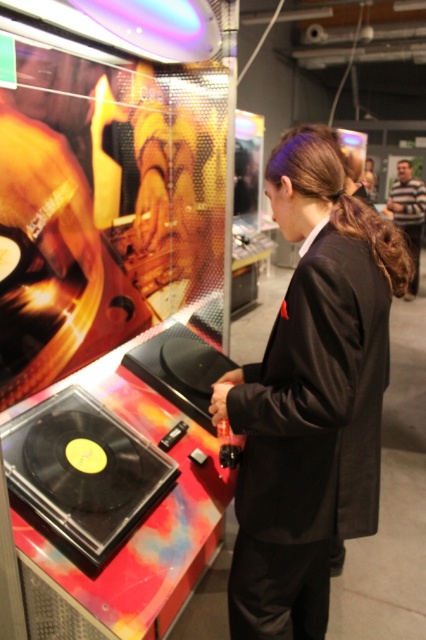
Consider the image. You are an event organizer planning to seat guests at a table. You have two items to place on the table next to each other. The black matte suit at center and the striped sweater at upper right. Which item should you place closer to the edge of the table to ensure both fit comfortably?

The black matte suit at center is thinner than the striped sweater at upper right, so placing the black matte suit at center closer to the edge would allow both items to fit comfortably on the table.

You are a photographer at the event and need to position a spotlight. The spotlight can only illuminate objects taller than the black matte suit at center. Can the striped sweater at upper right be illuminated by the spotlight?

The black matte suit at center is not as tall as striped sweater at upper right. Since the spotlight requires objects taller than the black matte suit at center, the striped sweater at upper right qualifies and can be illuminated by the spotlight.

You are an event planner organizing a fashion show and need to place a model wearing the black matte suit at center and another wearing the striped sweater at upper right. According to the spatial arrangement in the image, which model should be positioned to the left side of the runway?

The black matte suit at center should be positioned to the left side of the runway since it is already to the left of the striped sweater at upper right in the image.